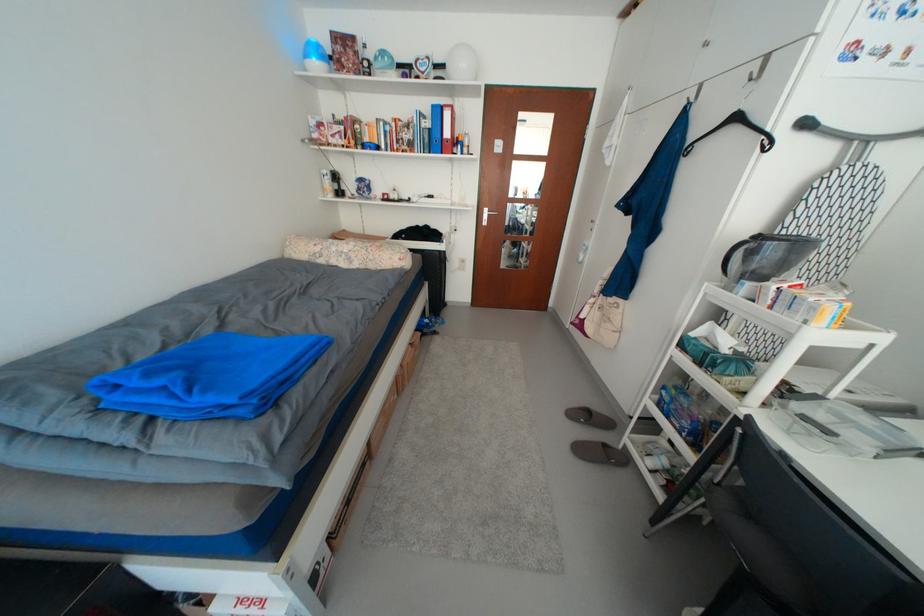
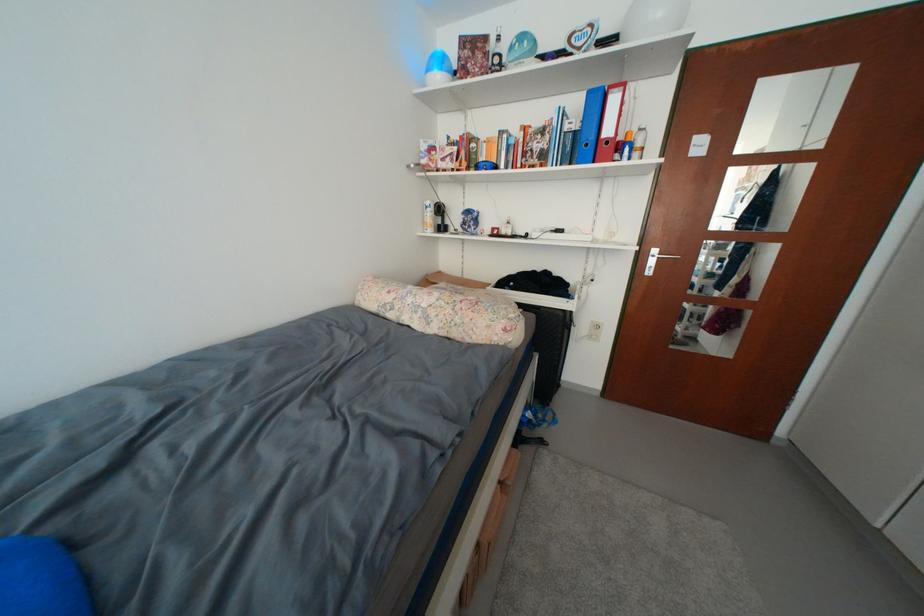
In the second image, find the point that corresponds to point 456,116 in the first image.

(623, 103)